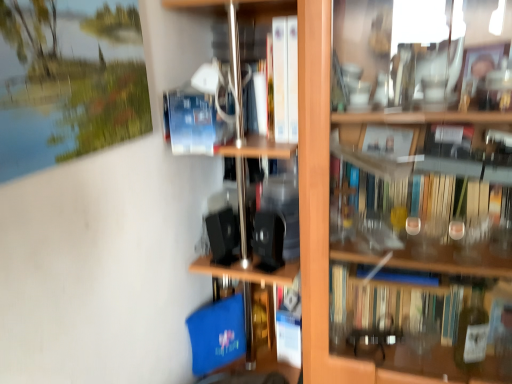
Question: Should I look upward or downward to see wooden shelf at center?

Choices:
 (A) down
 (B) up

Answer: (A)

Question: Does wooden shelf at center have a smaller size compared to white paper at center?

Choices:
 (A) yes
 (B) no

Answer: (B)

Question: Can you confirm if wooden shelf at center is shorter than white paper at center?

Choices:
 (A) yes
 (B) no

Answer: (B)

Question: Considering the relative sizes of wooden shelf at center and white paper at center in the image provided, is wooden shelf at center bigger than white paper at center?

Choices:
 (A) yes
 (B) no

Answer: (A)

Question: Is wooden shelf at center not close to white paper at center?

Choices:
 (A) yes
 (B) no

Answer: (B)

Question: Does wooden shelf at center touch white paper at center?

Choices:
 (A) no
 (B) yes

Answer: (A)

Question: Does wooden shelf at center contain white paper at center?

Choices:
 (A) no
 (B) yes

Answer: (B)

Question: Can you confirm if blue matte paperback book at center is taller than wooden shelf at center?

Choices:
 (A) no
 (B) yes

Answer: (A)

Question: Can we say blue matte paperback book at center lies outside wooden shelf at center?

Choices:
 (A) yes
 (B) no

Answer: (B)

Question: Considering the relative sizes of blue matte paperback book at center and wooden shelf at center in the image provided, is blue matte paperback book at center bigger than wooden shelf at center?

Choices:
 (A) yes
 (B) no

Answer: (B)

Question: From the image's perspective, is blue matte paperback book at center under wooden shelf at center?

Choices:
 (A) no
 (B) yes

Answer: (A)

Question: From a real-world perspective, is blue matte paperback book at center on top of wooden shelf at center?

Choices:
 (A) yes
 (B) no

Answer: (A)

Question: Is wooden shelf at center completely or partially inside blue matte paperback book at center?

Choices:
 (A) no
 (B) yes

Answer: (A)

Question: From a real-world perspective, is wooden shelf at center located beneath blue matte paperback book at center?

Choices:
 (A) no
 (B) yes

Answer: (B)